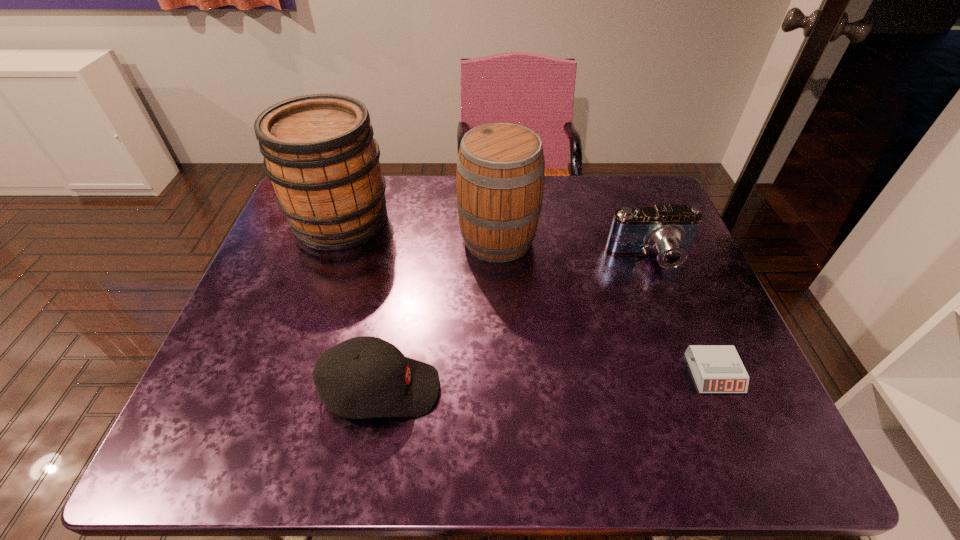
Identify the location of vacant region between the left cider and the baseball cap. (361, 305).

Where is `vacant space that is in between the third object from right to left and the left cider`? vacant space that is in between the third object from right to left and the left cider is located at coordinates (420, 230).

The height and width of the screenshot is (540, 960). In order to click on free spot between the baseball cap and the shortest object in this screenshot , I will do `click(547, 381)`.

Identify the location of free space between the camcorder and the shortest object. The image size is (960, 540). (683, 316).

In order to click on unoccupied area between the camcorder and the baseball cap in this screenshot , I will do `click(516, 323)`.

At what (x,y) coordinates should I click in order to perform the action: click on free space between the camcorder and the baseball cap. Please return your answer as a coordinate pair (x, y). Looking at the image, I should click on (516, 323).

This screenshot has height=540, width=960. In order to click on empty space that is in between the baseball cap and the left cider in this screenshot , I will do `click(361, 305)`.

Locate an element on the screen. free area in between the alarm clock and the left cider is located at coordinates (527, 296).

Where is `vacant space that's between the left cider and the shortest object`? Image resolution: width=960 pixels, height=540 pixels. vacant space that's between the left cider and the shortest object is located at coordinates (527, 296).

Identify the location of vacant space that is in between the baseball cap and the third object from right to left. The height and width of the screenshot is (540, 960). (440, 314).